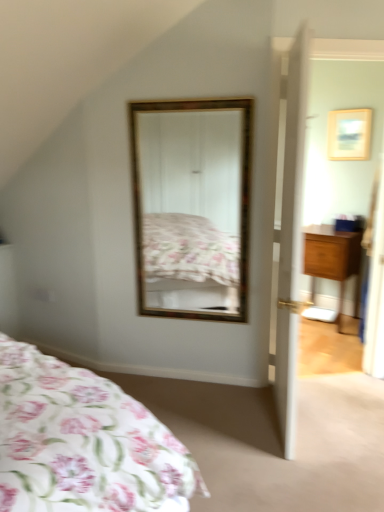
Find the location of `vacant area situated below gold-framed mirror at center (from a real-world perspective)`. vacant area situated below gold-framed mirror at center (from a real-world perspective) is located at coordinates (191, 372).